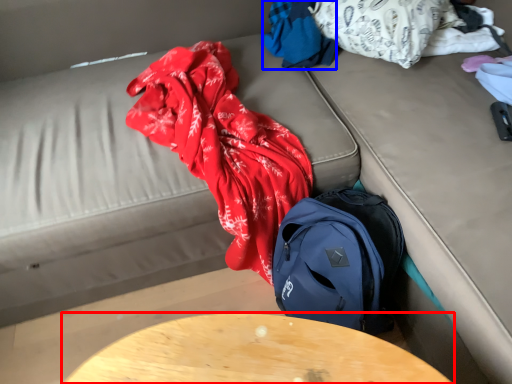
Question: Among these objects, which one is nearest to the camera, table (highlighted by a red box) or clothing (highlighted by a blue box)?

Choices:
 (A) table
 (B) clothing

Answer: (A)